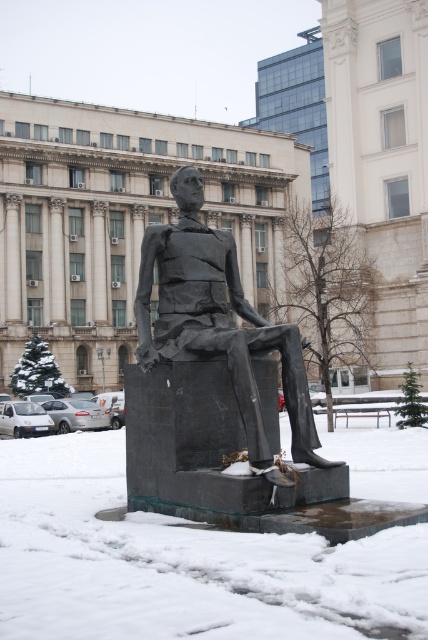
Question: Is the position of white frosty snow at lower center less distant than that of matte black statue at center?

Choices:
 (A) yes
 (B) no

Answer: (A)

Question: Can you confirm if white frosty snow at lower center is positioned below matte black statue at center?

Choices:
 (A) no
 (B) yes

Answer: (B)

Question: Does white frosty snow at lower center appear over matte black statue at center?

Choices:
 (A) no
 (B) yes

Answer: (A)

Question: Which object is farther from the camera taking this photo?

Choices:
 (A) white frosty snow at lower center
 (B) matte black statue at center

Answer: (B)

Question: Which point is closer to the camera?

Choices:
 (A) matte black statue at center
 (B) white frosty snow at lower center

Answer: (B)